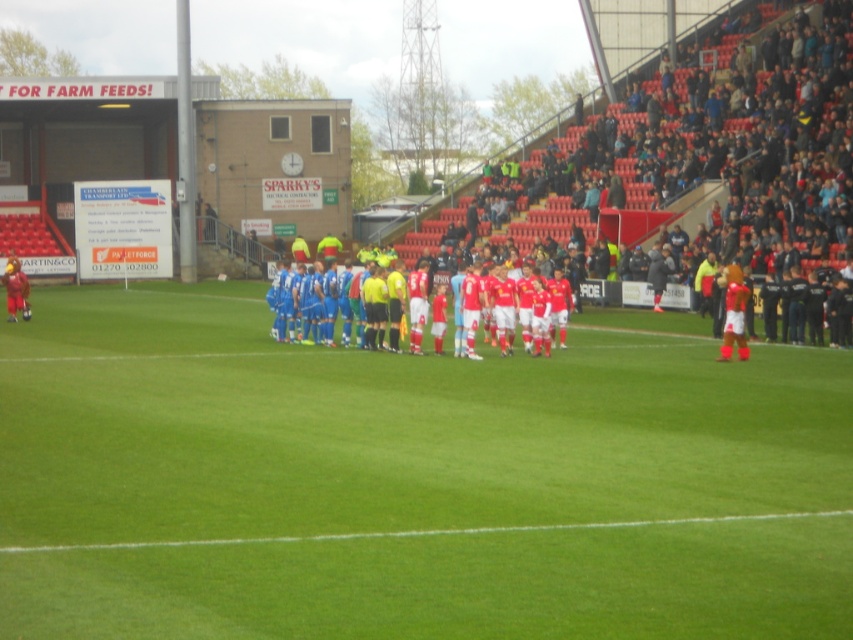
Question: Which of the following is the closest to the observer?

Choices:
 (A) (395, 344)
 (B) (109, 390)

Answer: (B)

Question: Is green grass field at center thinner than blue fabric jersey at center?

Choices:
 (A) no
 (B) yes

Answer: (A)

Question: Can you confirm if green grass field at center is positioned below blue fabric jersey at center?

Choices:
 (A) yes
 (B) no

Answer: (A)

Question: Which of the following is the closest to the observer?

Choices:
 (A) blue fabric jersey at center
 (B) green grass field at center

Answer: (B)

Question: Is green grass field at center smaller than blue fabric jersey at center?

Choices:
 (A) yes
 (B) no

Answer: (B)